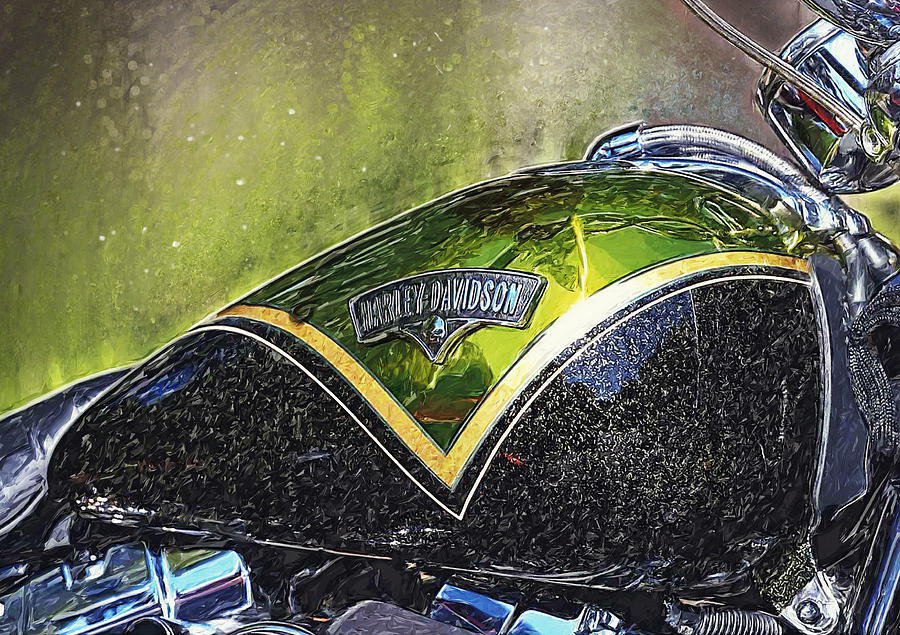
Identify the location of spring or radiator. (725, 620).